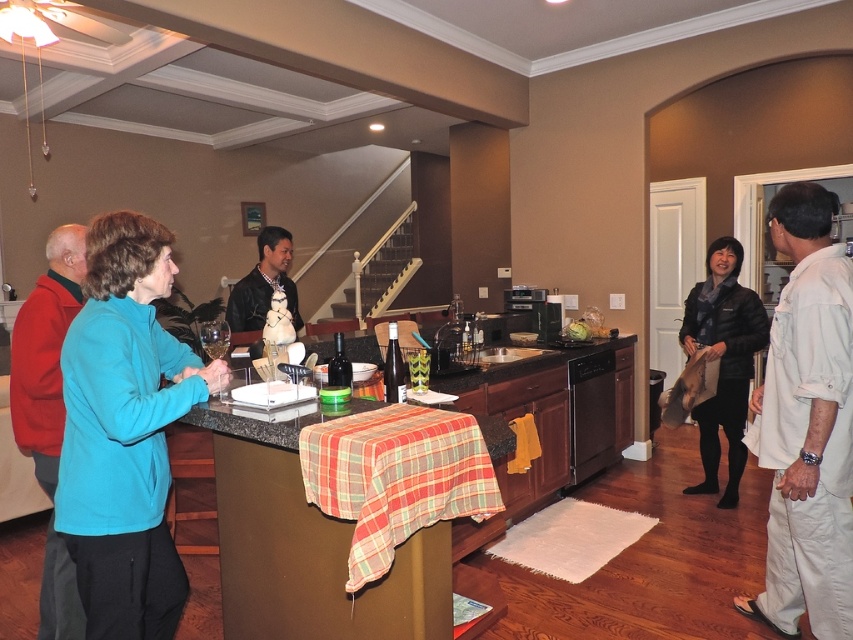
Question: Which point appears closest to the camera in this image?

Choices:
 (A) (711, 259)
 (B) (50, 314)
 (C) (442, 381)
 (D) (109, 426)

Answer: (D)

Question: Can you confirm if teal fabric jacket at left is thinner than teal fleece jacket at left?

Choices:
 (A) no
 (B) yes

Answer: (A)

Question: Does teal fabric jacket at left appear under teal fleece jacket at left?

Choices:
 (A) yes
 (B) no

Answer: (B)

Question: Which object appears farthest from the camera in this image?

Choices:
 (A) granite countertop at center
 (B) teal fleece jacket at left

Answer: (A)

Question: Is teal fabric jacket at left smaller than granite countertop at center?

Choices:
 (A) yes
 (B) no

Answer: (A)

Question: Which object appears closest to the camera in this image?

Choices:
 (A) white satin shirt at right
 (B) teal fleece jacket at left
 (C) granite countertop at center
 (D) teal fabric jacket at left

Answer: (D)